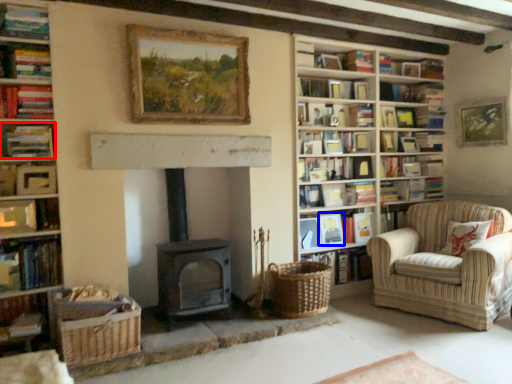
Question: Which point is closer to the camera, book (highlighted by a red box) or picture frame (highlighted by a blue box)?

Choices:
 (A) book
 (B) picture frame

Answer: (A)